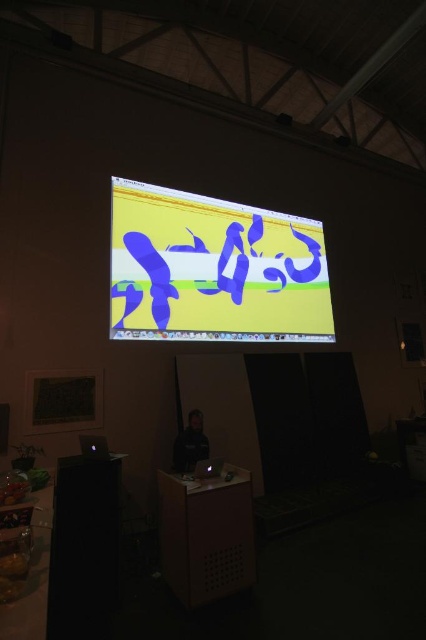
Question: Can you confirm if matte plastic screen at upper center is positioned below matte black laptop at center?

Choices:
 (A) yes
 (B) no

Answer: (B)

Question: Does matte plastic screen at upper center have a larger size compared to dark fabric jacket at center?

Choices:
 (A) yes
 (B) no

Answer: (A)

Question: Which of the following is the closest to the observer?

Choices:
 (A) (184, 442)
 (B) (212, 461)
 (C) (173, 204)

Answer: (B)

Question: Which object is positioned farthest from the matte plastic screen at upper center?

Choices:
 (A) dark fabric jacket at center
 (B) black glossy laptop at lower left

Answer: (B)

Question: Which point appears closest to the camera in this image?

Choices:
 (A) (189, 426)
 (B) (88, 442)
 (C) (218, 461)

Answer: (B)

Question: Is matte plastic screen at upper center to the right of matte black laptop at center from the viewer's perspective?

Choices:
 (A) no
 (B) yes

Answer: (B)